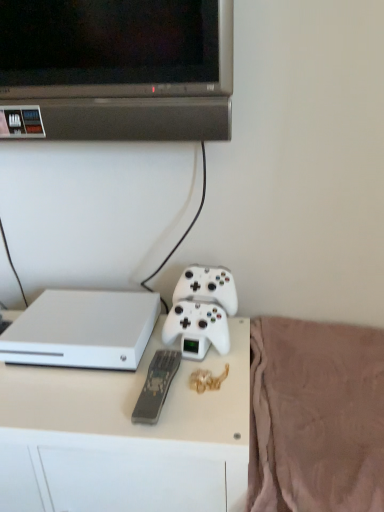
Locate an element on the screen. vacant space positioned to the left of gray matte remote at center is located at coordinates (82, 395).